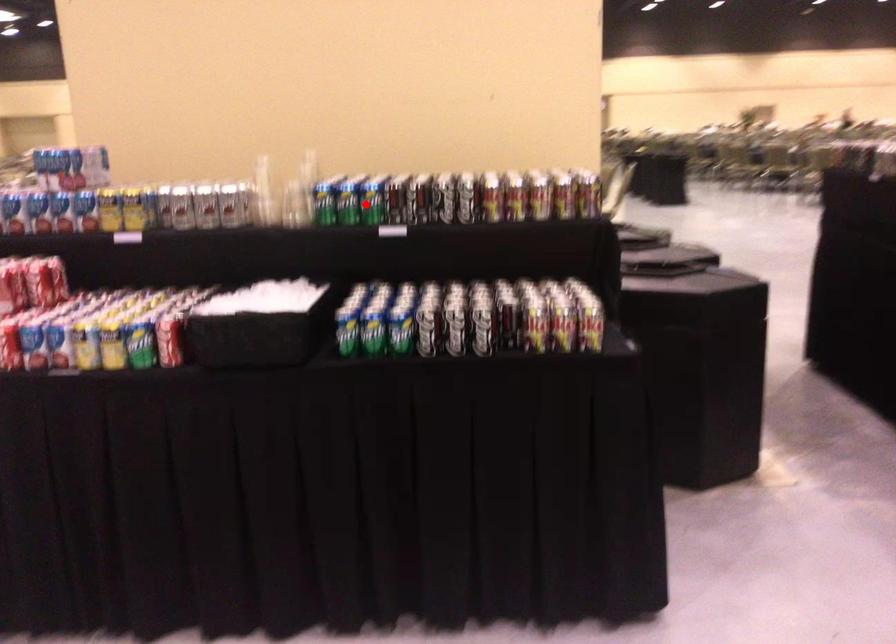
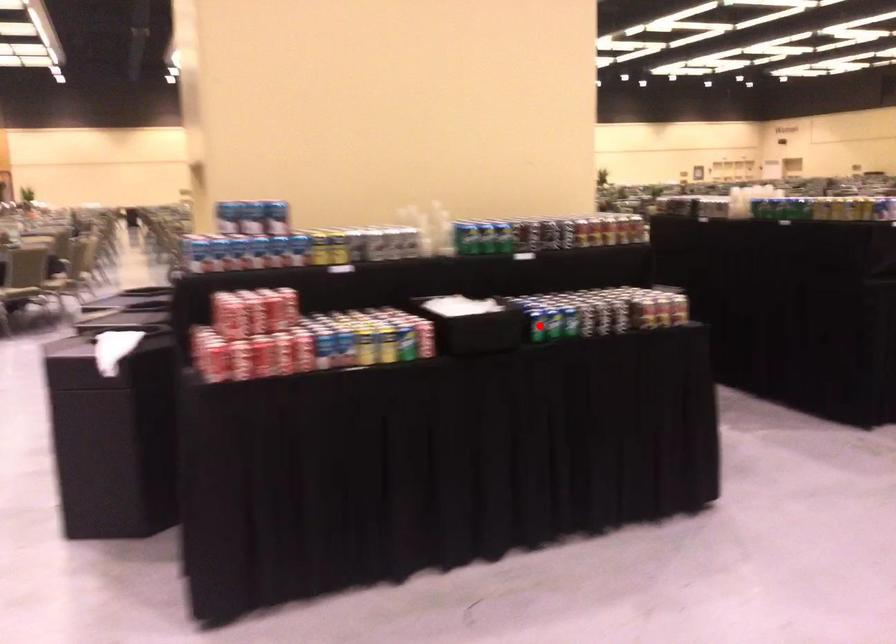
I am providing you with two images of the same scene from different viewpoints. A red point is marked on the first image and another point is marked on the second image. Do the highlighted points in image1 and image2 indicate the same real-world spot?

No